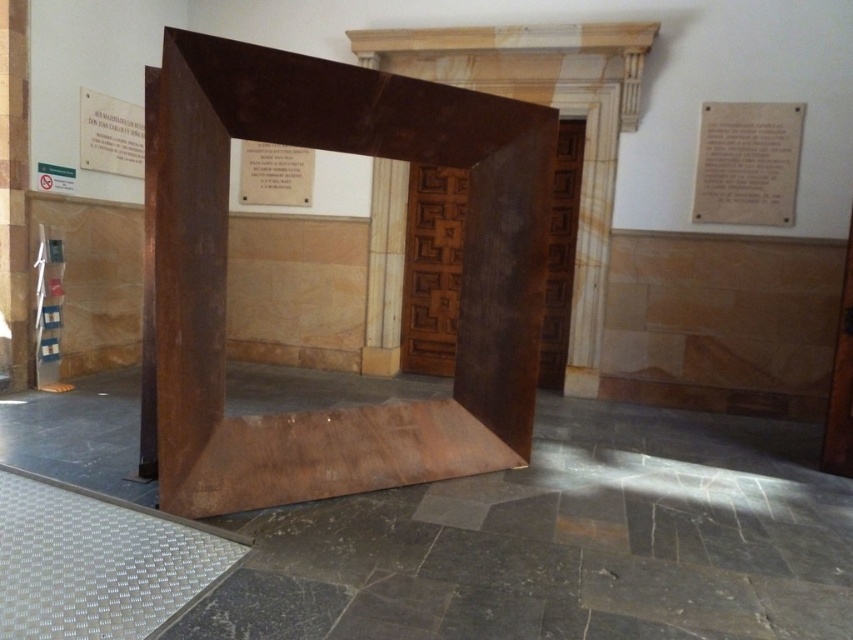
You are an interior designer assessing the layout of a room. You notice the rusty metal cube at center and the matte white plaque at upper right. Based on their positions, which object is closer to the left side of the room?

The rusty metal cube at center is to the left of the matte white plaque at upper right, so it is closer to the left side of the room.

You are an interior designer examining the modern interior. You notice the rusty metal cube at center and the matte white plaque at upper right. Which object is closer to you from your current viewpoint?

The rusty metal cube at center is in front of the matte white plaque at upper right, so it is closer to you.

You are an interior designer assessing the space. You need to place a new decorative item that requires a surface at least as wide as the matte white plaque at upper right. Can the rusty metal cube at center accommodate this item based on their widths?

The rusty metal cube at center has a width larger than the matte white plaque at upper right, so it can accommodate the decorative item.